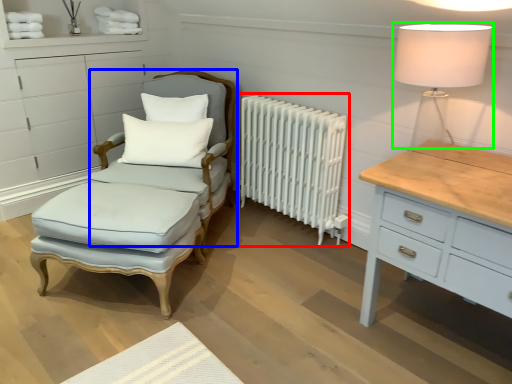
Question: Which object is the closest to the radiator (highlighted by a red box)? Choose among these: swivel chair (highlighted by a blue box) or table lamp (highlighted by a green box).

Choices:
 (A) swivel chair
 (B) table lamp

Answer: (A)